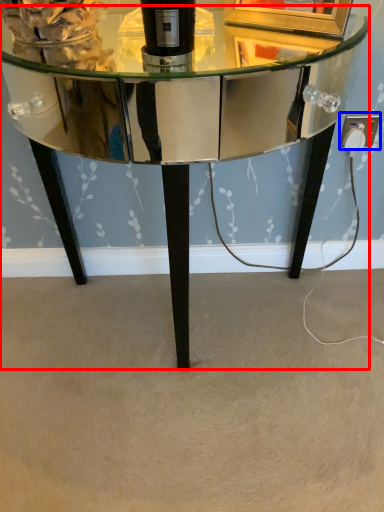
Question: Which object is further to the camera taking this photo, table (highlighted by a red box) or electric outlet (highlighted by a blue box)?

Choices:
 (A) table
 (B) electric outlet

Answer: (B)